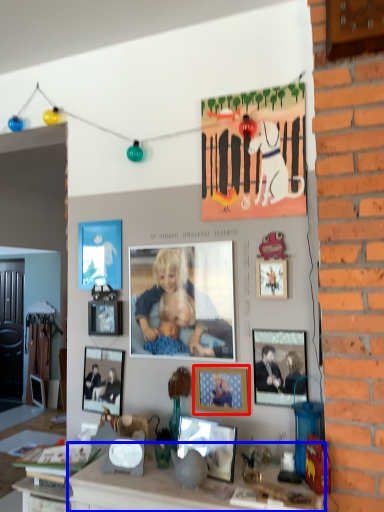
Question: Among these objects, which one is nearest to the camera, picture frame (highlighted by a red box) or counter (highlighted by a blue box)?

Choices:
 (A) picture frame
 (B) counter

Answer: (B)